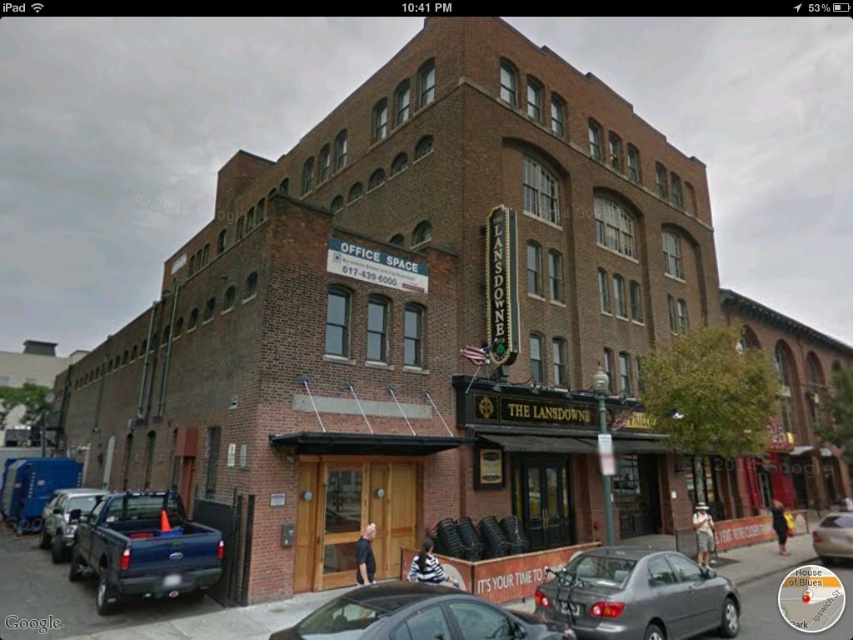
You are standing at the entrance of The Lansdowne and want to park your car. The parking lot has a designated parking spot at coordinates 0.931, 0.748. Can you determine if the matte gray sedan at lower center is already occupying that spot?

The matte gray sedan at lower center is located at point (x=637, y=595), so yes, it is occupying the designated parking spot at those coordinates.

You are a delivery driver who needs to park your vehicle in front of The Lansdowne building. You have two options for parking spots near the building. The first is near the matte black truck at left, and the second is near the silver metallic sedan at center. Which parking spot is closer to the OFFICE SPACE sign?

The matte black truck at left is to the left of the silver metallic sedan at center, so the parking spot near the matte black truck at left is closer to the OFFICE SPACE sign located to the left of the main building.

You are standing in front of The Lansdowne building and need to park your matte black truck at left. The parking spot you want is exactly 15 meters away from where you are standing. Can your truck fit into the spot?

The distance between the matte black truck at left and the camera is 14.98 meters, which is just under 15 meters. Therefore, the truck can fit into the parking spot.